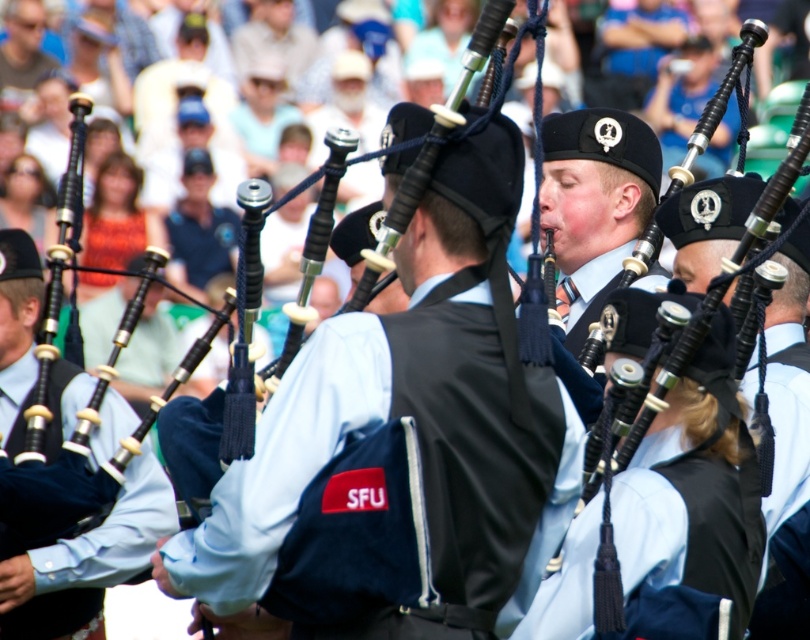
You are a photographer standing in front of the musicians. You want to take a photo of the matte black vest at center. Where should you aim your camera to capture the vest in the frame?

You should aim your camera at the point with coordinates (416,420) to capture the matte black vest at center in the frame.

You are a photographer at the event. You want to capture a photo where both the matte black vest at center and the matte black bagpipes at center are visible. Given their heights, which one will appear taller in the photo?

The matte black bagpipes at center will appear taller in the photo since they are taller than the matte black vest at center according to the description.

You are a photographer standing at the front of the crowd. You want to take a photo that includes both the matte black vest at center and the matte black bagpipes at center. The camera you have can focus on objects within a 15 meter range. Will both objects be in focus at the same time?

The matte black vest at center and matte black bagpipes at center are 20.30 meters apart from each other. Since the camera can only focus within 15 meters, both objects cannot be in focus simultaneously because their distance exceeds the camera range.